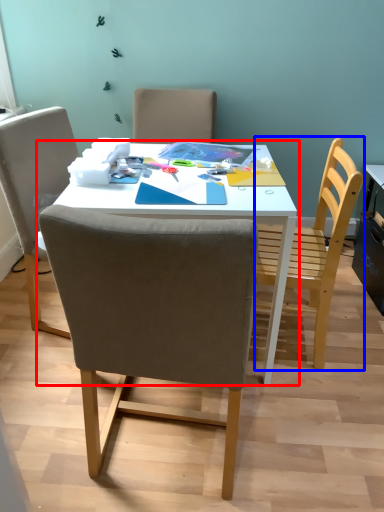
Question: Which of the following is the farthest to the observer, table (highlighted by a red box) or chair (highlighted by a blue box)?

Choices:
 (A) table
 (B) chair

Answer: (B)